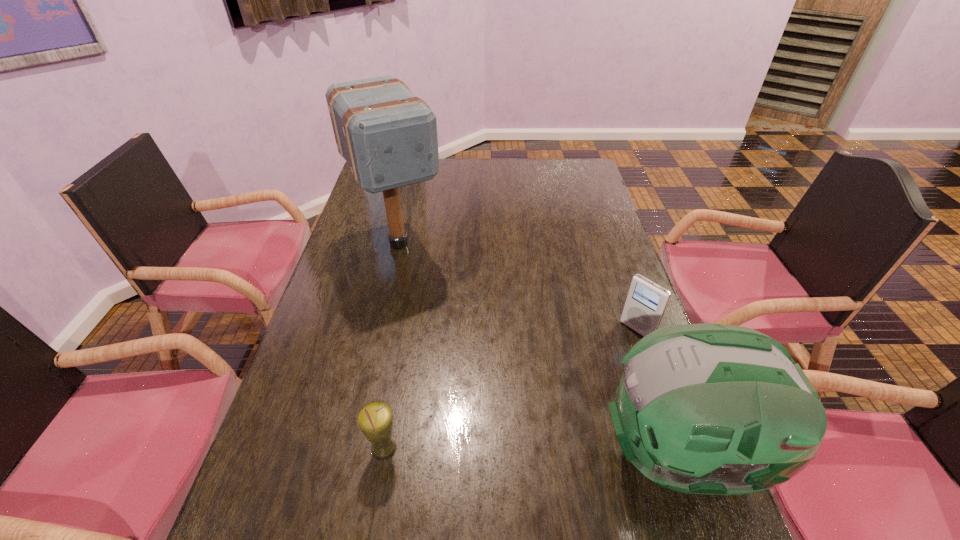
You are a GUI agent. You are given a task and a screenshot of the screen. Output one action in this format:
    pyautogui.click(x=<x>, y=<y>)
    Task: Click on the vacant region at the right edge
    Image resolution: width=960 pixels, height=540 pixels.
    Given the screenshot: What is the action you would take?
    pyautogui.click(x=578, y=281)

Locate an element on the screen. free space at the near left corner is located at coordinates (256, 478).

You are a GUI agent. You are given a task and a screenshot of the screen. Output one action in this format:
    pyautogui.click(x=<x>, y=<y>)
    Task: Click on the free space between the farthest object and the third shortest object
    
    Given the screenshot: What is the action you would take?
    pyautogui.click(x=540, y=349)

Locate an element on the screen. The height and width of the screenshot is (540, 960). free area in between the third nearest object and the straw for drinking is located at coordinates (511, 390).

Find the location of a particular element. Image resolution: width=960 pixels, height=540 pixels. free area in between the tallest object and the straw for drinking is located at coordinates (392, 347).

What are the coordinates of `unoccupied area between the third shortest object and the straw for drinking` in the screenshot? It's located at (533, 452).

The height and width of the screenshot is (540, 960). Identify the location of free space between the tallest object and the straw for drinking. (392, 347).

Where is `vacant area that lies between the straw for drinking and the second tallest object`? vacant area that lies between the straw for drinking and the second tallest object is located at coordinates (533, 452).

The image size is (960, 540). Identify the location of vacant area that lies between the second farthest object and the straw for drinking. (511, 390).

Where is `empty location between the third tallest object and the third nearest object`? The width and height of the screenshot is (960, 540). empty location between the third tallest object and the third nearest object is located at coordinates (511, 390).